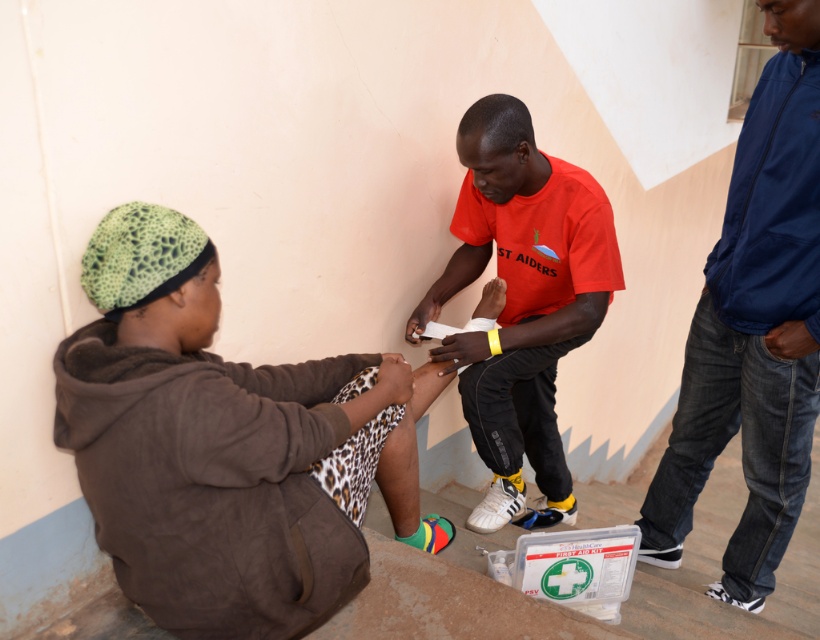
Based on the photo, which of these two, brown suede hoodie at lower left or blue jeans at right, stands taller?

With more height is blue jeans at right.

Is brown suede hoodie at lower left smaller than blue jeans at right?

Incorrect, brown suede hoodie at lower left is not smaller in size than blue jeans at right.

Does point (229, 440) come behind point (780, 502)?

No, it is not.

Locate an element on the screen. The image size is (820, 640). brown suede hoodie at lower left is located at coordinates (222, 444).

Is point (716, 248) behind point (525, 449)?

No, (716, 248) is closer to viewer.

How far apart are blue jeans at right and red matte t-shirt at center?

blue jeans at right is 19.18 inches away from red matte t-shirt at center.

Measure the distance between blue jeans at right and camera.

A distance of 1.40 meters exists between blue jeans at right and camera.

I want to click on blue jeans at right, so click(754, 328).

Does brown suede hoodie at lower left have a lesser width compared to red matte t-shirt at center?

No.

Between point (196, 326) and point (563, 285), which one is positioned behind?

Positioned behind is point (563, 285).

Locate an element on the screen. The image size is (820, 640). brown suede hoodie at lower left is located at coordinates point(222,444).